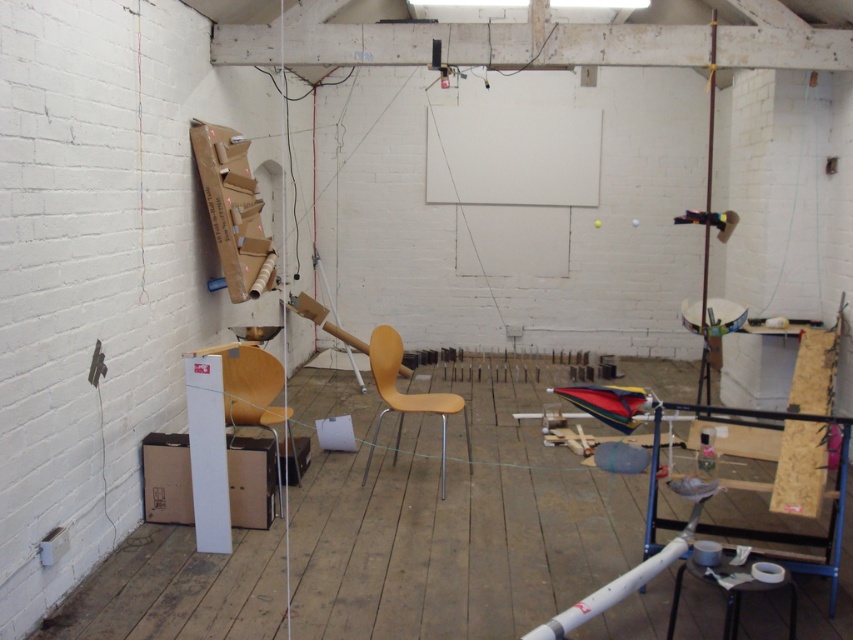
You are standing at the entrance of the studio and want to move towards the light brown wood chair at center. Which direction should you walk to reach it?

Since the light brown wood chair at center is located at coordinates approximately 0.616 on the x axis and 0.474 on the y axis, you should walk towards the center of the room to reach it.

You are planning to place a 1.2 meter wide desk between the light brown wood chair at center and the black plastic stool at lower right. Based on their widths, will the desk fit between them?

The light brown wood chair at center is wider than the black plastic stool at lower right. However, the desk is 1.2 meters wide, and without knowing the exact distance between the two objects, we cannot determine if the desk will fit. The question requires spatial information about the distance between the objects, not just their widths.

You are standing at the entrance of the workshop and notice the light brown wood chair at center and the wooden pole at right. Which object is closer to the floor?

The light brown wood chair at center is below the wooden pole at right, meaning it is closer to the floor than the wooden pole at right.